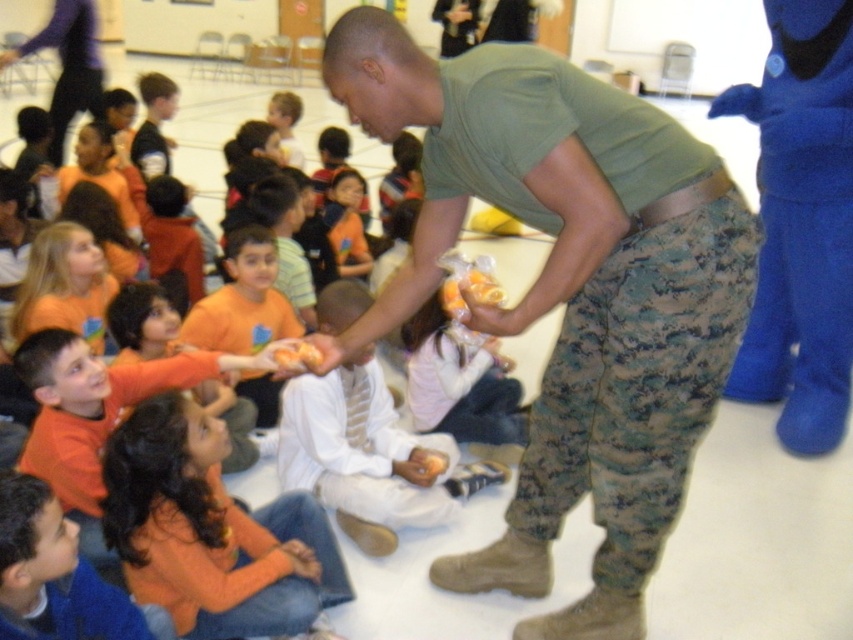
Does blue fleece mascot at right appear over orange shirt at center?

No, blue fleece mascot at right is not above orange shirt at center.

Does point (828, 13) come behind point (341, 189)?

No, (828, 13) is in front of (341, 189).

You are a GUI agent. You are given a task and a screenshot of the screen. Output one action in this format:
    pyautogui.click(x=<x>, y=<y>)
    Task: Click on the blue fleece mascot at right
    The width and height of the screenshot is (853, 640).
    Given the screenshot: What is the action you would take?
    pyautogui.click(x=801, y=225)

Does green camouflage pants at center have a lesser height compared to blue fleece mascot at right?

Indeed, green camouflage pants at center has a lesser height compared to blue fleece mascot at right.

From the picture: Is green camouflage pants at center further to the viewer compared to blue fleece mascot at right?

No, green camouflage pants at center is closer to the viewer.

The image size is (853, 640). Describe the element at coordinates (567, 291) in the screenshot. I see `green camouflage pants at center` at that location.

The height and width of the screenshot is (640, 853). I want to click on green camouflage pants at center, so click(x=567, y=291).

Is orange cotton shirt at lower left positioned behind camouflage pants at upper left?

No, it is not.

Is orange cotton shirt at lower left to the right of camouflage pants at upper left from the viewer's perspective?

Correct, you'll find orange cotton shirt at lower left to the right of camouflage pants at upper left.

Image resolution: width=853 pixels, height=640 pixels. Describe the element at coordinates (209, 531) in the screenshot. I see `orange cotton shirt at lower left` at that location.

Image resolution: width=853 pixels, height=640 pixels. Find the location of `orange cotton shirt at lower left`. orange cotton shirt at lower left is located at coordinates (209, 531).